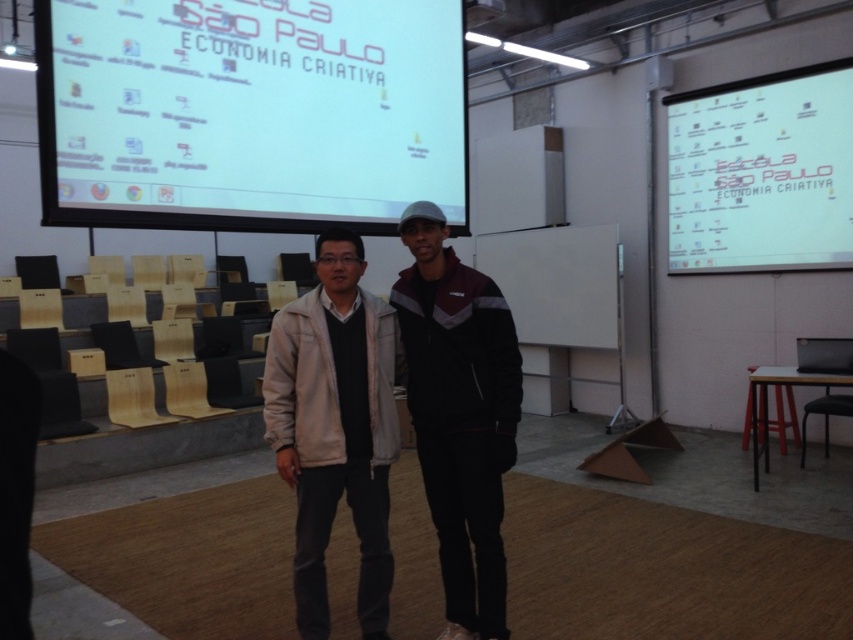
Who is higher up, light beige jacket at center or white paper at upper right?

white paper at upper right

Is point (437, 257) positioned before point (753, 196)?

Yes, point (437, 257) is in front of point (753, 196).

Image resolution: width=853 pixels, height=640 pixels. What do you see at coordinates (459, 413) in the screenshot? I see `light beige jacket at center` at bounding box center [459, 413].

You are a GUI agent. You are given a task and a screenshot of the screen. Output one action in this format:
    pyautogui.click(x=<x>, y=<y>)
    Task: Click on the light beige jacket at center
    The image size is (853, 640).
    Given the screenshot: What is the action you would take?
    pyautogui.click(x=459, y=413)

Is point (276, 132) positioned before point (704, 90)?

That is True.

Does point (242, 225) come farther from viewer compared to point (828, 179)?

No, (242, 225) is in front of (828, 179).

The width and height of the screenshot is (853, 640). I want to click on white matte projector screen at upper center, so click(x=248, y=113).

Can you confirm if white matte projector screen at upper center is taller than light beige jacket at center?

No, white matte projector screen at upper center is not taller than light beige jacket at center.

Does point (51, 45) come closer to viewer compared to point (459, 445)?

No, (51, 45) is further to viewer.

Locate an element on the screen. The image size is (853, 640). white matte projector screen at upper center is located at coordinates (248, 113).

Where is `white matte projector screen at upper center`? Image resolution: width=853 pixels, height=640 pixels. white matte projector screen at upper center is located at coordinates (248, 113).